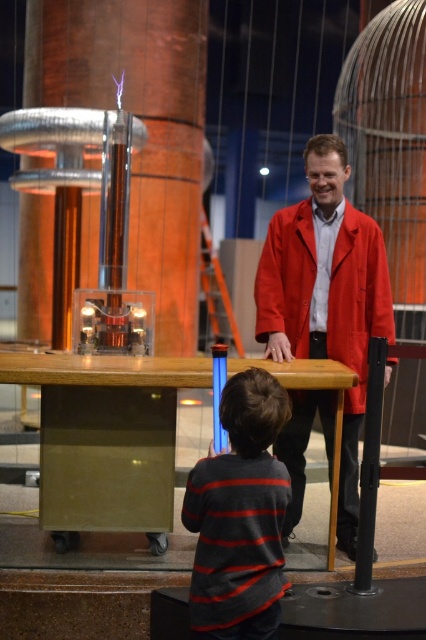
How far apart are matte red coat at center and striped sweater at center?

3.96 feet

Can you confirm if matte red coat at center is positioned to the left of striped sweater at center?

In fact, matte red coat at center is to the right of striped sweater at center.

Between point (345, 493) and point (230, 614), which one is positioned in front?

Positioned in front is point (230, 614).

The width and height of the screenshot is (426, 640). Identify the location of matte red coat at center. (327, 298).

The width and height of the screenshot is (426, 640). What do you see at coordinates (106, 435) in the screenshot?
I see `wooden table at center` at bounding box center [106, 435].

Does wooden table at center have a larger size compared to striped sweater at center?

Yes, wooden table at center is bigger than striped sweater at center.

Between point (118, 413) and point (281, 476), which one is positioned behind?

Point (118, 413)

Locate an element on the screen. This screenshot has width=426, height=640. wooden table at center is located at coordinates (106, 435).

Describe the element at coordinates (327, 298) in the screenshot. Image resolution: width=426 pixels, height=640 pixels. I see `matte red coat at center` at that location.

Is point (333, 182) behind point (68, 436)?

Yes, point (333, 182) is behind point (68, 436).

Is point (279, 260) less distant than point (158, 472)?

No.

What are the coordinates of `matte red coat at center` in the screenshot? It's located at (327, 298).